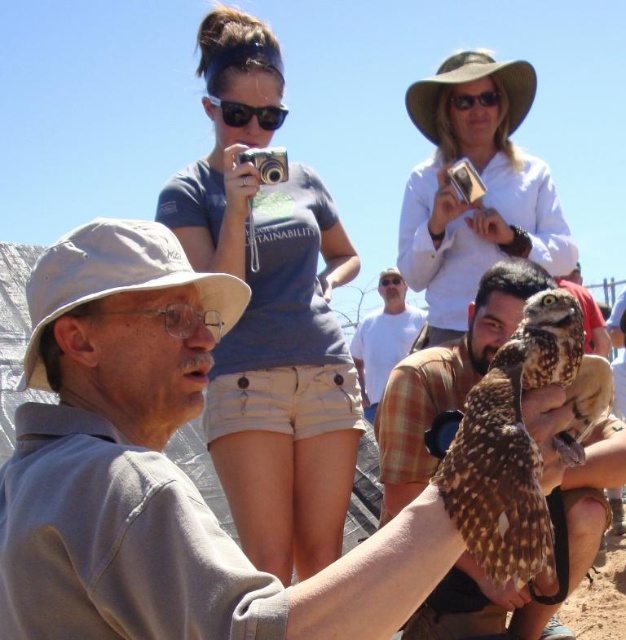
Consider the image. Does blue cotton shirt at upper center have a lesser width compared to black plastic goggles at upper center?

In fact, blue cotton shirt at upper center might be wider than black plastic goggles at upper center.

Is blue cotton shirt at upper center positioned before black plastic goggles at upper center?

That is True.

Identify the location of blue cotton shirt at upper center. Image resolution: width=626 pixels, height=640 pixels. (274, 352).

In the scene shown: Which is below, brown feathered owl at center or black plastic sunglasses at upper center?

Positioned lower is brown feathered owl at center.

Does point (613, 496) lie behind point (269, 120)?

Yes.

Is point (617, 304) closer to viewer compared to point (213, 102)?

No.

In order to click on brown feathered owl at center in this screenshot , I will do coord(618,353).

Is gray fabric shirt at center shorter than white cotton shirt at center?

Yes.

Is point (160, 342) more distant than point (403, 356)?

No, (160, 342) is in front of (403, 356).

Where is `gray fabric shirt at center`? This screenshot has width=626, height=640. gray fabric shirt at center is located at coordinates (160, 474).